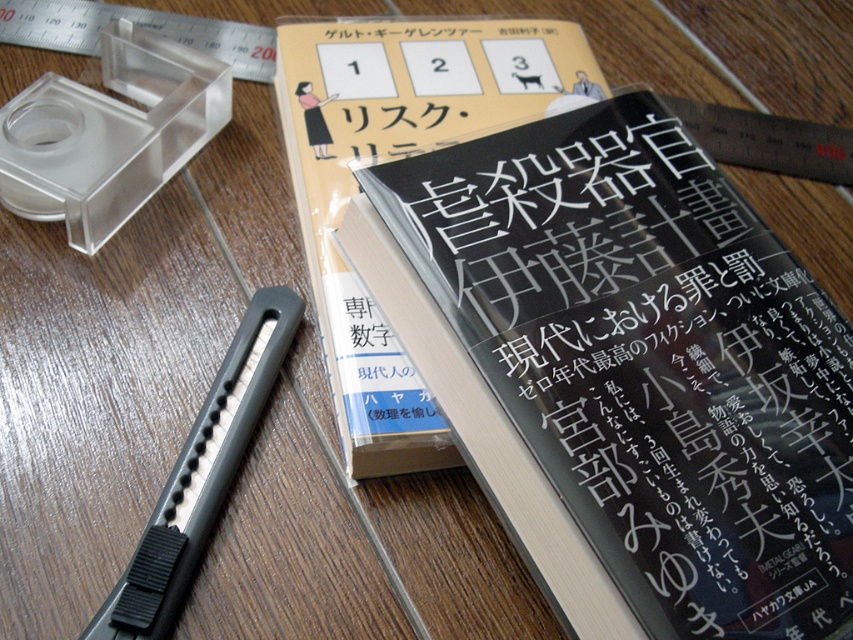
Question: Is black glossy book at center closer to camera compared to black matte book at center?

Choices:
 (A) no
 (B) yes

Answer: (B)

Question: Which point is farther to the camera?

Choices:
 (A) black glossy book at center
 (B) black matte book at center

Answer: (B)

Question: Among these points, which one is nearest to the camera?

Choices:
 (A) (550, 132)
 (B) (283, 48)

Answer: (A)

Question: Is black glossy book at center closer to camera compared to black matte book at center?

Choices:
 (A) no
 (B) yes

Answer: (B)

Question: Does black glossy book at center appear over black matte book at center?

Choices:
 (A) no
 (B) yes

Answer: (A)